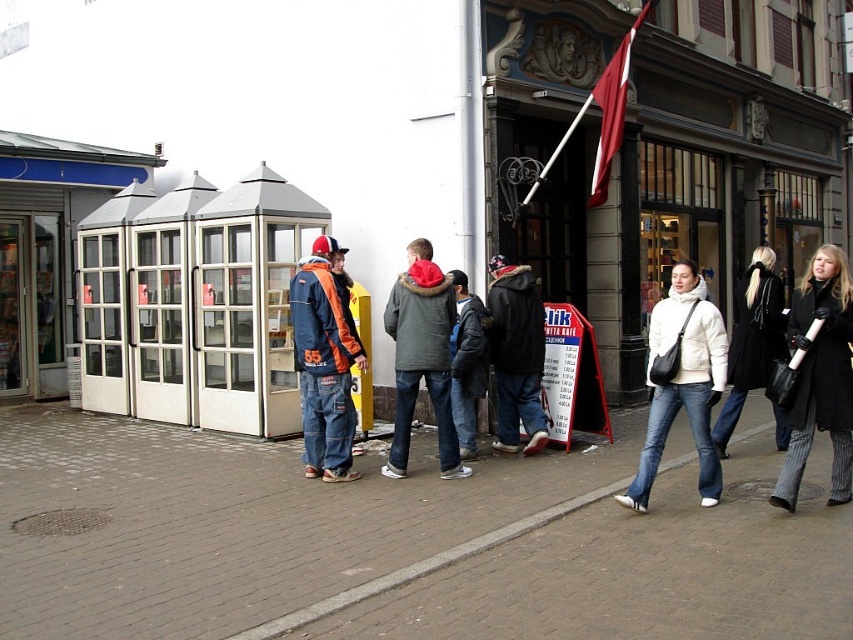
Question: From the image, what is the correct spatial relationship of dark blue jeans at center in relation to dark gray jacket at center?

Choices:
 (A) left
 (B) right

Answer: (B)

Question: Which object is farther from the camera taking this photo?

Choices:
 (A) dark gray jacket at center
 (B) brown brick pavement at lower center
 (C) striped wool coat at right
 (D) orange and black jacket at center

Answer: (A)

Question: Can you confirm if gray fleece jacket at center is positioned to the left of dark blue jeans at center?

Choices:
 (A) yes
 (B) no

Answer: (A)

Question: Among these points, which one is farthest from the camera?

Choices:
 (A) (601, 492)
 (B) (344, 310)
 (C) (465, 339)

Answer: (C)

Question: Which object is farther from the camera taking this photo?

Choices:
 (A) gray fleece jacket at center
 (B) black leather coat at right
 (C) red flag at upper center

Answer: (C)

Question: Can you confirm if striped wool coat at right is positioned above dark blue jeans at center?

Choices:
 (A) no
 (B) yes

Answer: (A)